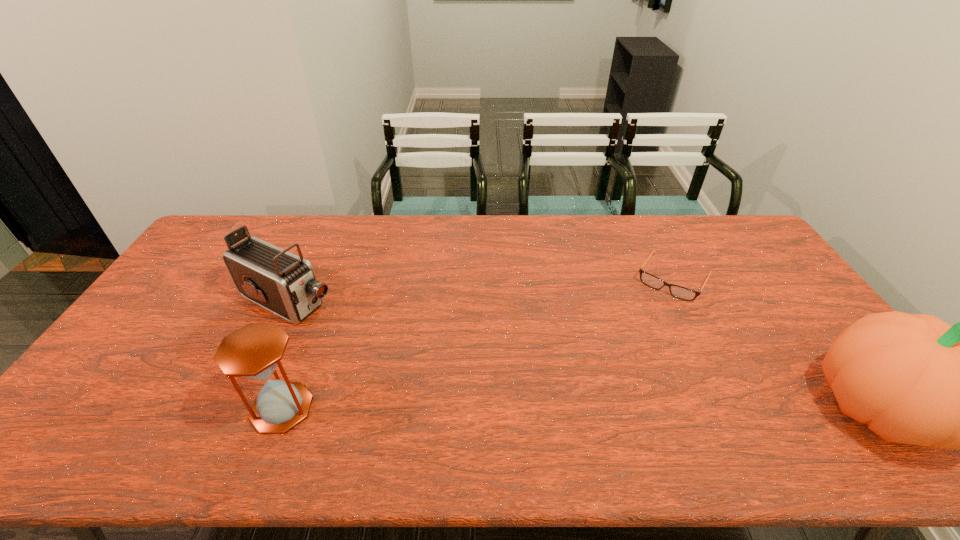
What are the coordinates of `vacant space located at the lens of the camcorder` in the screenshot? It's located at (388, 344).

At what (x,y) coordinates should I click in order to perform the action: click on object at the near edge. Please return your answer as a coordinate pair (x, y). Looking at the image, I should click on (254, 351).

Where is `vacant space at the far edge of the desktop`? This screenshot has width=960, height=540. vacant space at the far edge of the desktop is located at coordinates (508, 242).

In order to click on free space at the near edge of the desktop in this screenshot , I will do tap(384, 394).

Image resolution: width=960 pixels, height=540 pixels. What are the coordinates of `vacant area at the left edge of the desktop` in the screenshot? It's located at (205, 275).

Image resolution: width=960 pixels, height=540 pixels. Identify the location of blank area at the right edge. (786, 293).

The width and height of the screenshot is (960, 540). Find the location of `vacant region at the far left corner of the desktop`. vacant region at the far left corner of the desktop is located at coordinates (247, 220).

Locate an element on the screen. The height and width of the screenshot is (540, 960). free space at the near left corner of the desktop is located at coordinates (90, 407).

Where is `free space at the far right corner of the desktop`? This screenshot has height=540, width=960. free space at the far right corner of the desktop is located at coordinates (700, 222).

Find the location of a particular element. This screenshot has width=960, height=540. free area in between the camcorder and the hourglass is located at coordinates (285, 354).